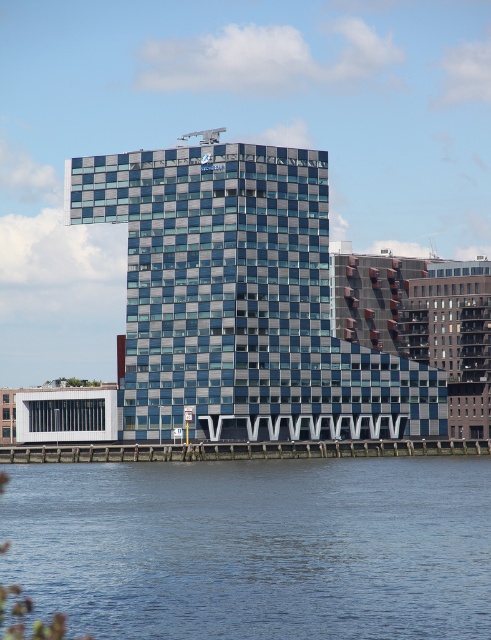
The width and height of the screenshot is (491, 640). Describe the element at coordinates (254, 547) in the screenshot. I see `blue water at lower center` at that location.

Is point (129, 474) behind point (303, 193)?

No, (129, 474) is closer to viewer.

At what (x,y) coordinates should I click in order to perform the action: click on blue water at lower center. Please return your answer as a coordinate pair (x, y). This screenshot has height=640, width=491. Looking at the image, I should click on (254, 547).